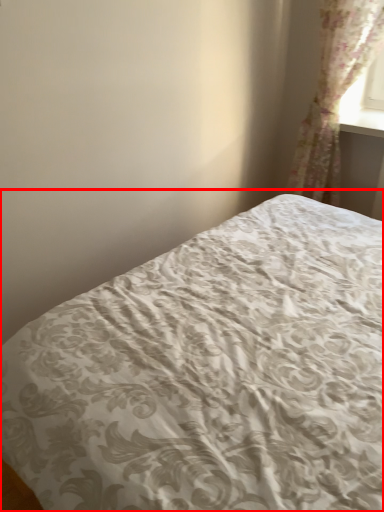
Question: From the image's perspective, where is bed (annotated by the red box) located in relation to curtain in the image?

Choices:
 (A) below
 (B) above

Answer: (A)